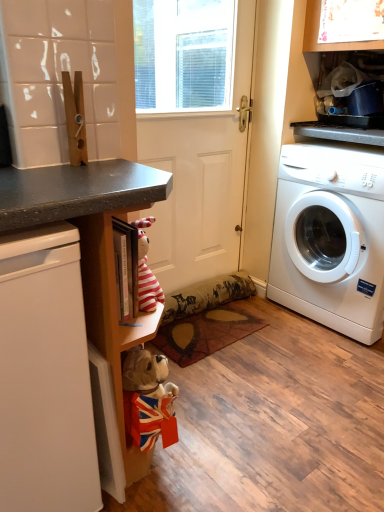
Identify the location of free space in front of patterned fabric mat at center. (236, 383).